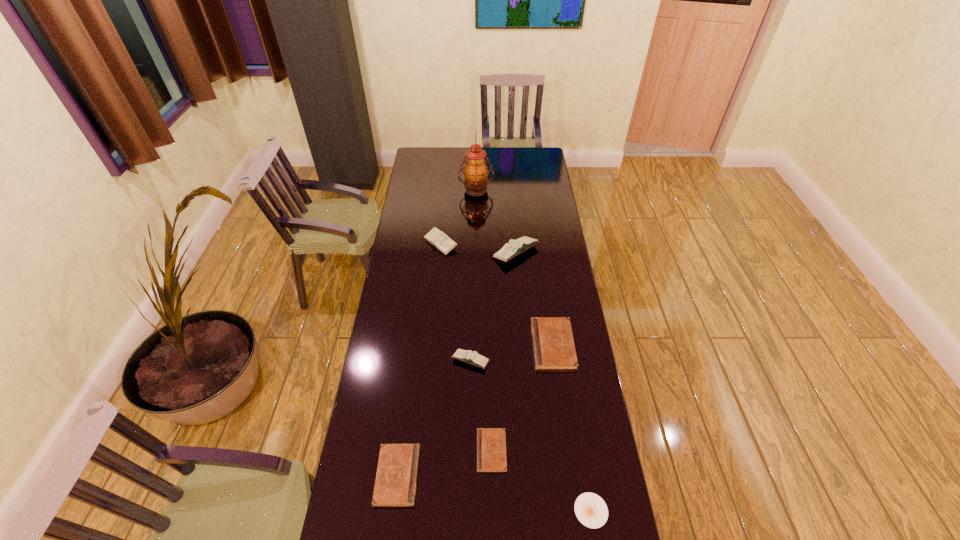
This screenshot has height=540, width=960. Find the location of `the farthest object`. the farthest object is located at coordinates (476, 172).

This screenshot has width=960, height=540. In order to click on the tallest object in this screenshot , I will do `click(476, 172)`.

This screenshot has height=540, width=960. In order to click on the tallest diary in this screenshot , I will do (x=515, y=247).

Where is `the seventh shortest object`? This screenshot has width=960, height=540. the seventh shortest object is located at coordinates (515, 247).

Identify the location of the sixth shortest object. (437, 238).

At what (x,y) coordinates should I click in order to perform the action: click on the second smallest pink diary. Please return your answer as a coordinate pair (x, y). This screenshot has width=960, height=540. Looking at the image, I should click on (437, 238).

Identify the location of the fifth shortest object. Image resolution: width=960 pixels, height=540 pixels. (467, 356).

Locate an element on the screen. Image resolution: width=960 pixels, height=540 pixels. the fourth shortest diary is located at coordinates (467, 356).

Locate an element on the screen. The height and width of the screenshot is (540, 960). the biggest brown diary is located at coordinates (553, 345).

Identify the location of the farthest brown diary. (553, 345).